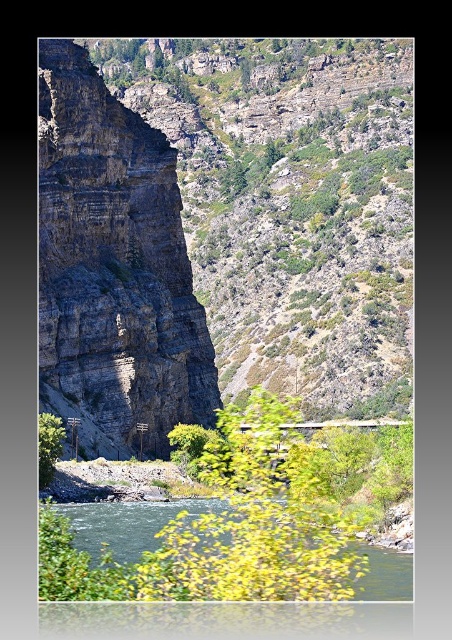
This screenshot has height=640, width=452. Describe the element at coordinates (127, 524) in the screenshot. I see `green smooth water at lower center` at that location.

Is point (372, 598) behind point (59, 452)?

No, (372, 598) is closer to viewer.

This screenshot has width=452, height=640. In order to click on green smooth water at lower center in this screenshot , I will do `click(127, 524)`.

Based on the photo, measure the distance between dark gray rocky cliff at left and green smooth water at lower center.

16.47 meters

Does dark gray rocky cliff at left have a larger size compared to green smooth water at lower center?

Yes, dark gray rocky cliff at left is bigger than green smooth water at lower center.

Between point (78, 100) and point (358, 596), which one is positioned in front?

Point (358, 596)

Find the location of a particular element. The width and height of the screenshot is (452, 640). dark gray rocky cliff at left is located at coordinates (113, 262).

Is dark gray rocky cliff at left smaller than green leafy tree at center?

No.

Measure the distance between dark gray rocky cliff at left and camera.

dark gray rocky cliff at left and camera are 230.34 feet apart from each other.

Identify the location of dark gray rocky cliff at left. The width and height of the screenshot is (452, 640). (113, 262).

Locate an element on the screen. Image resolution: width=452 pixels, height=640 pixels. dark gray rocky cliff at left is located at coordinates (113, 262).